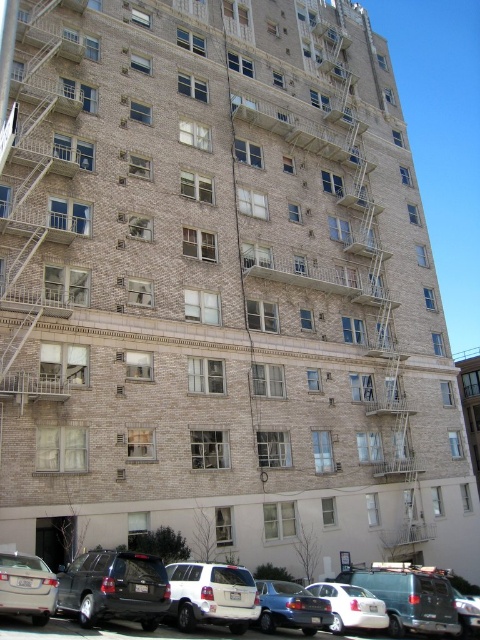
You are standing at point A, which is located at point (177,609). You need to reach point B, which is 27.89 meters away. Given the building structure described, which direction should you move to reach point B?

You should move in the direction away from the building since point B is 27.89 meters away from point A at point (177,609).

You are standing in front of the residential building and notice two points marked on the building facade. The first point is at coordinate point (213, 604) and the second at point (28, 614). Which point is closer to you?

Point (213, 604) is further to the viewer than point (28, 614), so the point closer to you is point (28, 614).